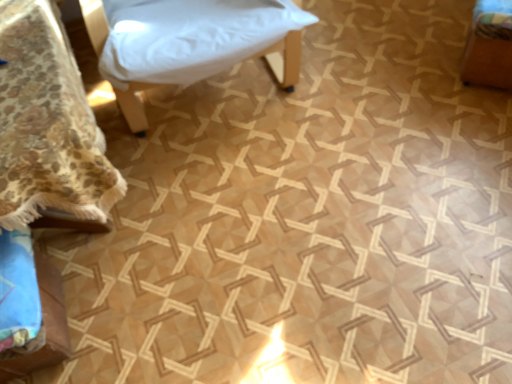
Find the location of a particular element. vacant space to the right of white fabric cushion at upper center, acting as the third furniture starting from the left is located at coordinates (381, 71).